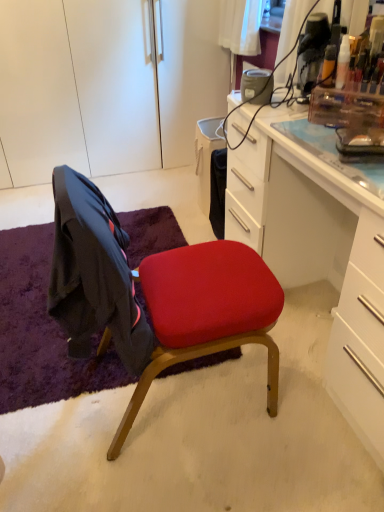
Locate an element on the screen. This screenshot has height=512, width=384. white glossy desk at center is located at coordinates (320, 247).

Measure the distance between matte red cushioned chair at center and camera.

matte red cushioned chair at center and camera are 36.07 inches apart.

Based on the photo, what is the approximate width of purple shaggy rug at lower left?

The width of purple shaggy rug at lower left is 4.13 feet.

Find the location of a particular element. Image resolution: width=384 pixels, height=512 pixels. purple shaggy rug at lower left is located at coordinates (41, 331).

Identify the location of white matte cabinet at upper left. (105, 85).

From a real-world perspective, is white glossy desk at center positioned under matte red cushioned chair at center based on gravity?

Yes, from a real-world perspective, white glossy desk at center is below matte red cushioned chair at center.

In the scene shown: Do you think white glossy desk at center is within matte red cushioned chair at center, or outside of it?

white glossy desk at center is spatially situated outside matte red cushioned chair at center.

Is white glossy desk at center at the left side of matte red cushioned chair at center?

No, white glossy desk at center is not to the left of matte red cushioned chair at center.

Considering the positions of objects matte red cushioned chair at center and white matte cabinet at upper left in the image provided, who is behind, matte red cushioned chair at center or white matte cabinet at upper left?

white matte cabinet at upper left is further away from the camera.

Considering the relative sizes of matte red cushioned chair at center and white matte cabinet at upper left in the image provided, is matte red cushioned chair at center bigger than white matte cabinet at upper left?

Incorrect, matte red cushioned chair at center is not larger than white matte cabinet at upper left.

From a real-world perspective, which object rests below the other?

From a 3D spatial view, matte red cushioned chair at center is below.

Is matte red cushioned chair at center next to white matte cabinet at upper left and touching it?

matte red cushioned chair at center and white matte cabinet at upper left are clearly separated.

From the image's perspective, which one is positioned higher, white glossy desk at center or purple shaggy rug at lower left?

white glossy desk at center is shown above in the image.

Does white glossy desk at center have a greater width compared to purple shaggy rug at lower left?

No.

How many degrees apart are the facing directions of white glossy desk at center and purple shaggy rug at lower left?

They differ by 89.7 degrees in their facing directions.

Which object is positioned more to the right, purple shaggy rug at lower left or matte red cushioned chair at center?

Positioned to the right is matte red cushioned chair at center.

Is purple shaggy rug at lower left inside or outside of matte red cushioned chair at center?

purple shaggy rug at lower left lies outside matte red cushioned chair at center.

From the picture: Does purple shaggy rug at lower left touch matte red cushioned chair at center?

No, purple shaggy rug at lower left is not touching matte red cushioned chair at center.

Which is less distant, (162, 246) or (172, 296)?

Point (162, 246).

How far apart are purple shaggy rug at lower left and white glossy desk at center?

purple shaggy rug at lower left and white glossy desk at center are 81.70 centimeters apart from each other.

Considering the sizes of objects purple shaggy rug at lower left and white glossy desk at center in the image provided, who is bigger, purple shaggy rug at lower left or white glossy desk at center?

white glossy desk at center is bigger.

From a real-world perspective, is purple shaggy rug at lower left physically located above or below white glossy desk at center?

purple shaggy rug at lower left is situated lower than white glossy desk at center in the real world.

Is purple shaggy rug at lower left outside of white glossy desk at center?

Indeed, purple shaggy rug at lower left is completely outside white glossy desk at center.

Does purple shaggy rug at lower left appear on the left side of white matte cabinet at upper left?

Incorrect, purple shaggy rug at lower left is not on the left side of white matte cabinet at upper left.

Considering the sizes of objects purple shaggy rug at lower left and white matte cabinet at upper left in the image provided, who is wider, purple shaggy rug at lower left or white matte cabinet at upper left?

With larger width is purple shaggy rug at lower left.

Is point (32, 367) closer or farther from the camera than point (135, 98)?

Point (32, 367) is closer to the camera than point (135, 98).

From the image's perspective, is white matte cabinet at upper left under purple shaggy rug at lower left?

No, from the image's perspective, white matte cabinet at upper left is not beneath purple shaggy rug at lower left.

From a real-world perspective, is white matte cabinet at upper left over purple shaggy rug at lower left?

Yes, from a real-world perspective, white matte cabinet at upper left is above purple shaggy rug at lower left.

Considering the relative positions of white matte cabinet at upper left and purple shaggy rug at lower left in the image provided, is white matte cabinet at upper left to the left of purple shaggy rug at lower left from the viewer's perspective?

Indeed, white matte cabinet at upper left is positioned on the left side of purple shaggy rug at lower left.

Is white matte cabinet at upper left looking in the opposite direction of purple shaggy rug at lower left?

No, white matte cabinet at upper left's orientation is not away from purple shaggy rug at lower left.

Where is `chair that appears above the white glossy desk at center (from a real-world perspective)`? The width and height of the screenshot is (384, 512). chair that appears above the white glossy desk at center (from a real-world perspective) is located at coordinates (162, 296).

I want to click on chair located below the white matte cabinet at upper left (from the image's perspective), so click(162, 296).

When comparing their distances from white matte cabinet at upper left, does white glossy desk at center or purple shaggy rug at lower left seem further?

white glossy desk at center lies further to white matte cabinet at upper left than the other object.

Looking at the image, which one is located closer to white matte cabinet at upper left, matte red cushioned chair at center or white glossy desk at center?

The object closer to white matte cabinet at upper left is white glossy desk at center.

In the scene shown: From the image, which object appears to be farther from purple shaggy rug at lower left, matte red cushioned chair at center or white glossy desk at center?

white glossy desk at center is further to purple shaggy rug at lower left.

Based on their spatial positions, is matte red cushioned chair at center or purple shaggy rug at lower left further from white matte cabinet at upper left?

matte red cushioned chair at center lies further to white matte cabinet at upper left than the other object.

From the image, which object appears to be farther from white matte cabinet at upper left, purple shaggy rug at lower left or matte red cushioned chair at center?

matte red cushioned chair at center.

Which object lies further to the anchor point matte red cushioned chair at center, purple shaggy rug at lower left or white glossy desk at center?

purple shaggy rug at lower left lies further to matte red cushioned chair at center than the other object.

Looking at the image, which one is located further to purple shaggy rug at lower left, white glossy desk at center or matte red cushioned chair at center?

Among the two, white glossy desk at center is located further to purple shaggy rug at lower left.

Which object lies further to the anchor point white glossy desk at center, matte red cushioned chair at center or purple shaggy rug at lower left?

The object further to white glossy desk at center is purple shaggy rug at lower left.

Locate an element on the screen. Image resolution: width=384 pixels, height=512 pixels. chair situated between purple shaggy rug at lower left and white glossy desk at center from left to right is located at coordinates pos(162,296).

Identify the location of chair between white glossy desk at center and white matte cabinet at upper left along the z-axis. Image resolution: width=384 pixels, height=512 pixels. (162, 296).

Where is `chair between white matte cabinet at upper left and purple shaggy rug at lower left from top to bottom`? chair between white matte cabinet at upper left and purple shaggy rug at lower left from top to bottom is located at coordinates (162, 296).

What are the coordinates of `desk between white matte cabinet at upper left and purple shaggy rug at lower left from top to bottom` in the screenshot? It's located at (320, 247).